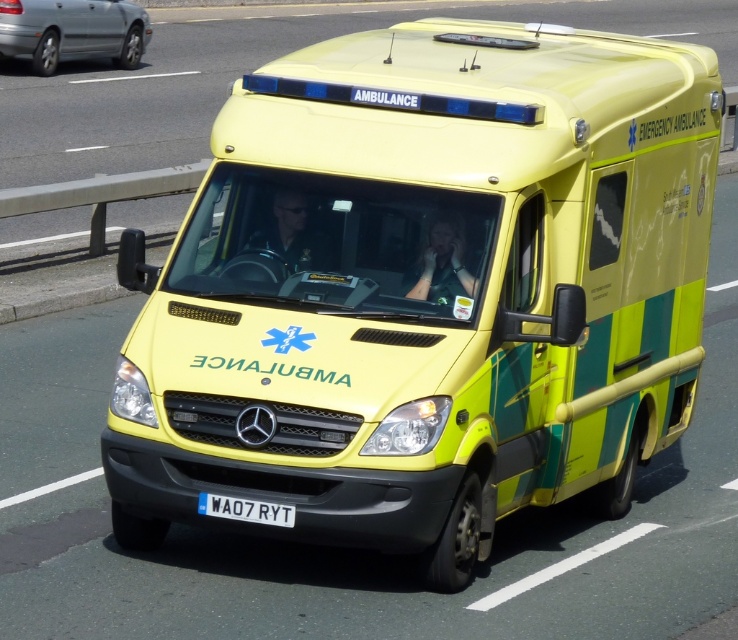
You are a pedestrian on the sidewalk and see the silver metallic sedan at upper left and the white plastic license plate at center. Which object is closer to you?

The white plastic license plate at center is behind the silver metallic sedan at upper left, so the silver metallic sedan at upper left is closer to you.

You are a delivery driver who needs to load a package onto the silver metallic sedan at upper left and the white plastic license plate at center. Which vehicle part requires a higher loading platform?

The silver metallic sedan at upper left requires a higher loading platform because it has a greater height compared to the white plastic license plate at center.